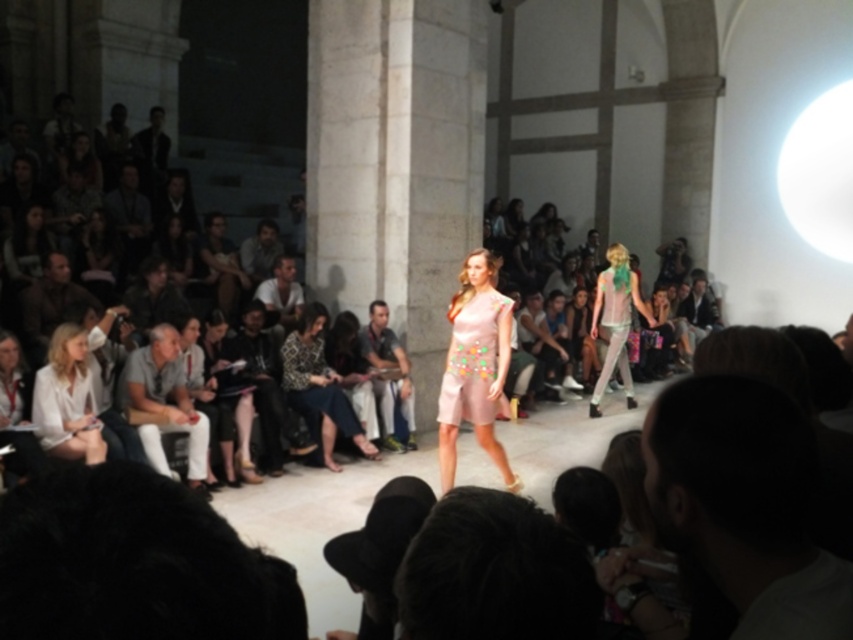
You are a photographer standing at the back of the hall. You want to capture a photo of both the pale pink satin dress at center and the white cotton shirt at center in the same frame. Given that your camera has a maximum focus range of 2.5 meters, will you be able to include both subjects in the photo?

The distance between the pale pink satin dress at center and the white cotton shirt at center is 2.79 meters, which exceeds the camera maximum focus range of 2.5 meters. Therefore, you cannot include both subjects in the same photo.

You are a photographer at the fashion show. You want to take a photo of both the pastel pink fabric dress at center and the light brown leather jacket at upper center in the same frame. Can you position yourself such that both items are within the camera lens? Explain your reasoning.

The pastel pink fabric dress at center and the light brown leather jacket at upper center are 3.20 meters apart from each other. Since the camera lens can capture objects within a certain distance depending on its focal length, if the photographer positions themselves far enough away, both items can be included in the frame. However, if the distance between them is within the camera lens range, it should be possible. The exact feasibility depends on the lens specifications, but given the 3.20 meters apart,